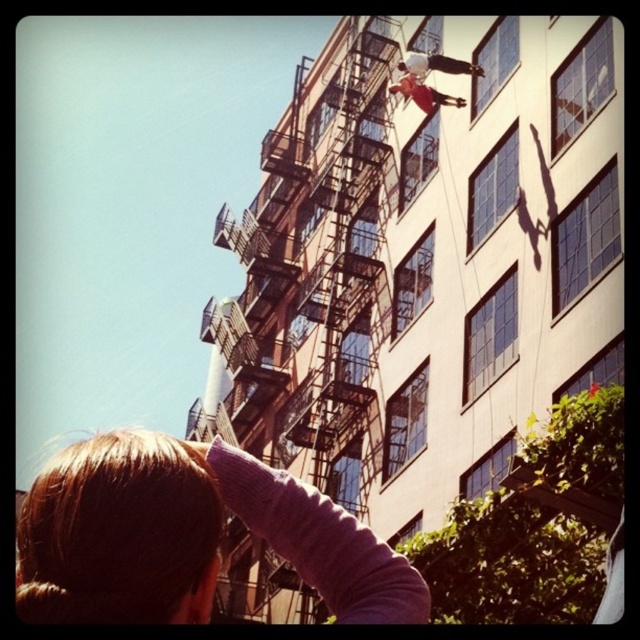
Describe the element at coordinates (310, 278) in the screenshot. I see `metallic fire escape at center` at that location.

Does metallic fire escape at center appear on the right side of blonde hair at lower left?

No, metallic fire escape at center is not to the right of blonde hair at lower left.

Does point (342, 317) lie behind point (259, 474)?

Yes.

Where is `metallic fire escape at center`? Image resolution: width=640 pixels, height=640 pixels. metallic fire escape at center is located at coordinates (310, 278).